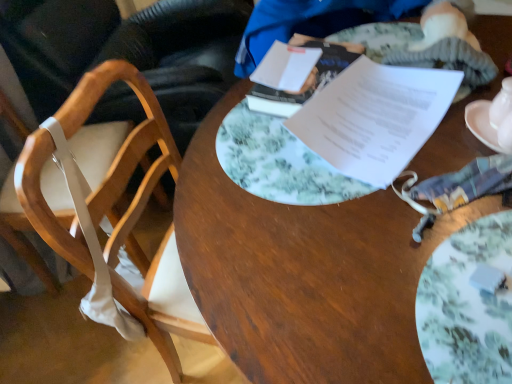
What do you see at coordinates (131, 52) in the screenshot? This screenshot has width=512, height=384. I see `wooden chair at left, placed as the second chair when sorted from right to left` at bounding box center [131, 52].

Describe the element at coordinates (28, 257) in the screenshot. The width and height of the screenshot is (512, 384). I see `white fabric chair at left, arranged as the second chair when viewed from the left` at that location.

Locate an element on the screen. The image size is (512, 384). white glossy teapot at upper right is located at coordinates (501, 104).

The image size is (512, 384). In order to click on wooden desk at center in this screenshot , I will do `click(304, 273)`.

The height and width of the screenshot is (384, 512). I want to click on white paper at upper center, which ranks as the 2th journal in front-to-back order, so click(294, 75).

In the scene shown: Which is less distant, [283,52] or [490,102]?

Point [283,52].

Considering their positions, is white paper at upper center, which ranks as the 2th journal in front-to-back order, located in front of or behind white ceramic saucer at right?

In the image, white paper at upper center, which ranks as the 2th journal in front-to-back order, appears behind white ceramic saucer at right.

Can you tell me how much white paper at upper center, which ranks as the 2th journal in front-to-back order, and white ceramic saucer at right differ in facing direction?

The facing directions of white paper at upper center, which ranks as the 2th journal in front-to-back order, and white ceramic saucer at right are 24.4 degrees apart.

Is white ceramic saucer at right a part of white paper at upper center, marked as the 1th journal in a back-to-front arrangement?

Definitely not — white ceramic saucer at right is not inside white paper at upper center, marked as the 1th journal in a back-to-front arrangement.

From a real-world perspective, is porcelain floral plate at center physically above white glossy teapot at upper right?

No, from a real-world perspective, porcelain floral plate at center is not above white glossy teapot at upper right.

From the image's perspective, is porcelain floral plate at center on top of white glossy teapot at upper right?

No, from the image's perspective, porcelain floral plate at center is not on top of white glossy teapot at upper right.

Looking at their sizes, would you say porcelain floral plate at center is wider or thinner than white glossy teapot at upper right?

porcelain floral plate at center is wider than white glossy teapot at upper right.

Is porcelain floral plate at center oriented towards white glossy teapot at upper right?

Yes, porcelain floral plate at center is aimed at white glossy teapot at upper right.

Choose the correct answer: Is white fabric chair at left, arranged as the second chair when viewed from the left, inside white ceramic saucer at right or outside it?

white fabric chair at left, arranged as the second chair when viewed from the left, is outside white ceramic saucer at right.

Is point (59, 284) in front of point (467, 108)?

No, it is behind (467, 108).

From a real-world perspective, who is located lower, white fabric chair at left, arranged as the second chair when viewed from the left, or white ceramic saucer at right?

white fabric chair at left, arranged as the second chair when viewed from the left, from a real-world perspective.

Considering the relative sizes of white fabric chair at left, arranged as the second chair when viewed from the left, and white ceramic saucer at right in the image provided, is white fabric chair at left, arranged as the second chair when viewed from the left, smaller than white ceramic saucer at right?

No, white fabric chair at left, arranged as the second chair when viewed from the left, is not smaller than white ceramic saucer at right.

Is white glossy teapot at upper right positioned beyond the bounds of white ceramic saucer at right?

No.

Based on the photo, from a real-world perspective, between white glossy teapot at upper right and white ceramic saucer at right, who is vertically higher?

white glossy teapot at upper right.

Does white glossy teapot at upper right touch white ceramic saucer at right?

Yes, white glossy teapot at upper right is touching white ceramic saucer at right.

Could you tell me if white glossy teapot at upper right is turned towards white ceramic saucer at right?

No, white glossy teapot at upper right does not turn towards white ceramic saucer at right.

From the image's perspective, which is below, white ceramic saucer at right or white fabric chair at left, acting as the first chair starting from the right?

From the image's view, white fabric chair at left, acting as the first chair starting from the right, is below.

Is there a large distance between white ceramic saucer at right and white fabric chair at left, acting as the first chair starting from the right?

white ceramic saucer at right is far away from white fabric chair at left, acting as the first chair starting from the right.

Can you confirm if white ceramic saucer at right is taller than white fabric chair at left, acting as the first chair starting from the right?

No.

Which is more to the left, white ceramic saucer at right or white fabric chair at left, acting as the first chair starting from the right?

white fabric chair at left, acting as the first chair starting from the right.

Considering the sizes of white ceramic saucer at right and white paper at upper center, which ranks as the 2th journal in front-to-back order, in the image, is white ceramic saucer at right bigger or smaller than white paper at upper center, which ranks as the 2th journal in front-to-back order,?

Considering their sizes, white ceramic saucer at right takes up less space than white paper at upper center, which ranks as the 2th journal in front-to-back order.

Could you tell me if white ceramic saucer at right is facing white paper at upper center, marked as the 1th journal in a back-to-front arrangement?

No.

From the image's perspective, which is above, white ceramic saucer at right or white paper at upper center, marked as the 1th journal in a back-to-front arrangement?

white paper at upper center, marked as the 1th journal in a back-to-front arrangement, appears higher in the image.

Choose the correct answer: Is wooden desk at center inside porcelain floral plate at center or outside it?

wooden desk at center exists outside the volume of porcelain floral plate at center.

At what (x,y) coordinates should I click in order to perform the action: click on plate lying in front of the wooden desk at center. Please return your answer as a coordinate pair (x, y). Image resolution: width=512 pixels, height=384 pixels. Looking at the image, I should click on (468, 305).

From a real-world perspective, is wooden desk at center above or below porcelain floral plate at center?

From a real-world perspective, wooden desk at center is physically below porcelain floral plate at center.

Find the location of a particular element. Image resolution: width=512 pixels, height=384 pixels. saucer that is below the white paper at upper center, marked as the 1th journal in a back-to-front arrangement (from the image's perspective) is located at coordinates tap(482, 124).

This screenshot has height=384, width=512. In order to click on plate on the left of white glossy teapot at upper right in this screenshot , I will do `click(468, 305)`.

Which object lies further to the anchor point wooden desk at center, white fabric chair at left, arranged as the second chair when viewed from the left, or white paper at center, which is the second journal from back to front?

white fabric chair at left, arranged as the second chair when viewed from the left, lies further to wooden desk at center than the other object.

From the image, which object appears to be nearer to white fabric chair at left, acting as the first chair starting from the right, white paper at center, which is the second journal from back to front, or wooden desk at center?

Among the two, wooden desk at center is located nearer to white fabric chair at left, acting as the first chair starting from the right.

Looking at the image, which one is located further to wooden chair at left, placed as the second chair when sorted from right to left, white paper at upper center, which ranks as the 2th journal in front-to-back order, or porcelain floral plate at center?

porcelain floral plate at center is further to wooden chair at left, placed as the second chair when sorted from right to left.

Estimate the real-world distances between objects in this image. Which object is closer to wooden desk at center, white glossy teapot at upper right or white fabric chair at left, arranged as the second chair when viewed from the left?

white glossy teapot at upper right lies closer to wooden desk at center than the other object.

Which object lies nearer to the anchor point wooden desk at center, porcelain floral plate at center or wooden chair at left, which is the 1th chair from left to right?

The object closer to wooden desk at center is porcelain floral plate at center.

Looking at this image, when comparing their distances from white fabric chair at left, acting as the first chair starting from the right, does porcelain floral plate at center or white ceramic saucer at right seem further?

white ceramic saucer at right lies further to white fabric chair at left, acting as the first chair starting from the right, than the other object.

Considering their positions, is white ceramic saucer at right positioned further to porcelain floral plate at center than white fabric chair at left, arranged as the second chair when viewed from the left?

The object further to porcelain floral plate at center is white fabric chair at left, arranged as the second chair when viewed from the left.

Which object lies nearer to the anchor point porcelain floral plate at center, wooden chair at left, which is the 1th chair from left to right, or white paper at upper center, which ranks as the 2th journal in front-to-back order?

white paper at upper center, which ranks as the 2th journal in front-to-back order, is positioned closer to the anchor porcelain floral plate at center.

This screenshot has width=512, height=384. Find the location of `journal between white paper at upper center, which ranks as the 2th journal in front-to-back order, and white ceramic saucer at right from left to right`. journal between white paper at upper center, which ranks as the 2th journal in front-to-back order, and white ceramic saucer at right from left to right is located at coordinates (375, 118).

The height and width of the screenshot is (384, 512). In order to click on tableware between porcelain floral plate at center and white paper at upper center, marked as the 1th journal in a back-to-front arrangement, in the front-back direction in this screenshot , I will do `click(501, 104)`.

I want to click on plate between white paper at center, marked as the 1th journal in a front-to-back arrangement, and wooden desk at center from top to bottom, so (468, 305).

You are a GUI agent. You are given a task and a screenshot of the screen. Output one action in this format:
    pyautogui.click(x=<x>, y=<y>)
    Task: Click on the tableware between white paper at upper center, marked as the 1th journal in a back-to-front arrangement, and white ceramic saucer at right, in the horizontal direction
    
    Given the screenshot: What is the action you would take?
    pyautogui.click(x=501, y=104)